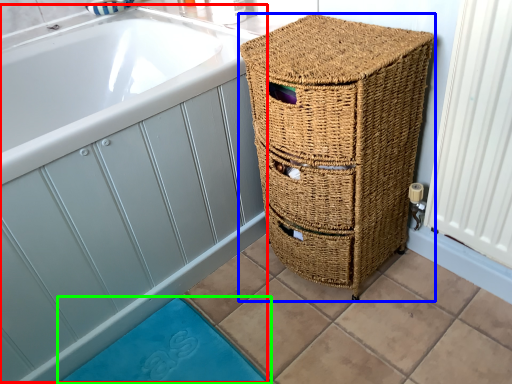
Question: Which object is positioned closest to bath (highlighted by a red box)? Select from furniture (highlighted by a blue box) and bath mat (highlighted by a green box).

Choices:
 (A) furniture
 (B) bath mat

Answer: (A)